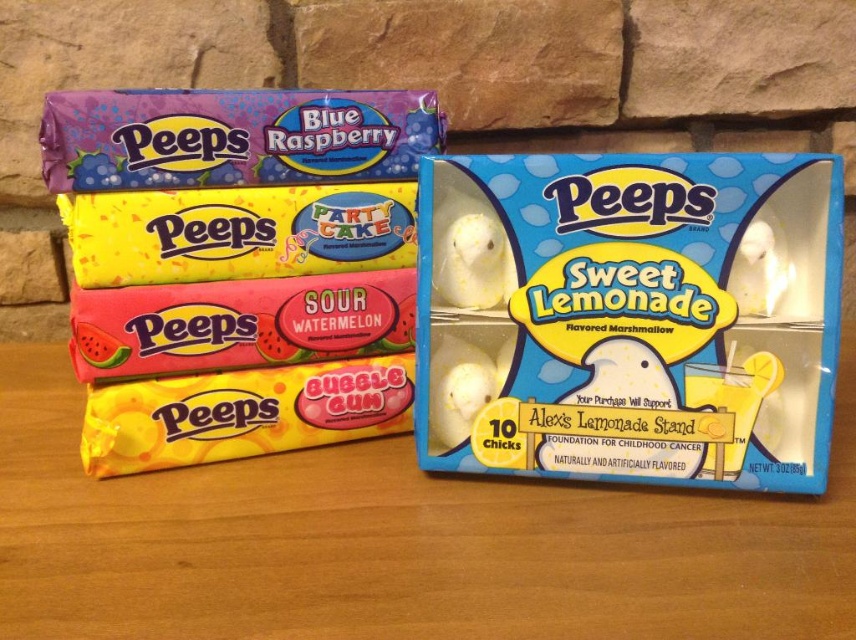
Question: Which point is closer to the camera?

Choices:
 (A) (209, 580)
 (B) (324, 224)

Answer: (A)

Question: Which point is farther to the camera?

Choices:
 (A) (389, 481)
 (B) (348, 264)
 (C) (111, 467)
 (D) (724, 436)

Answer: (B)

Question: Can you confirm if white marshmallow chicks at center is positioned to the right of matte plastic peeps at left?

Choices:
 (A) yes
 (B) no

Answer: (A)

Question: Estimate the real-world distances between objects in this image. Which object is farther from the wooden table at center?

Choices:
 (A) yellow glossy marshmallow at center
 (B) white marshmallow chicks at center

Answer: (A)

Question: Does white marshmallow chicks at center appear over matte plastic peeps at left?

Choices:
 (A) yes
 (B) no

Answer: (B)

Question: Does white marshmallow chicks at center lie behind yellow matte bubble gum at lower left?

Choices:
 (A) yes
 (B) no

Answer: (B)